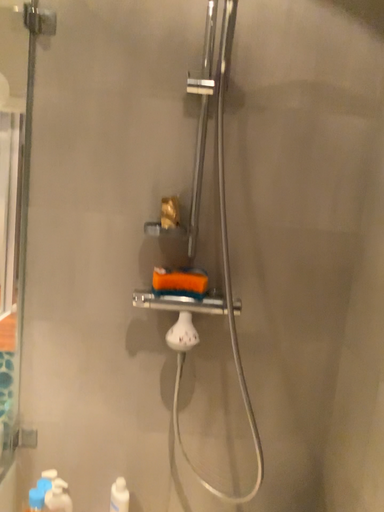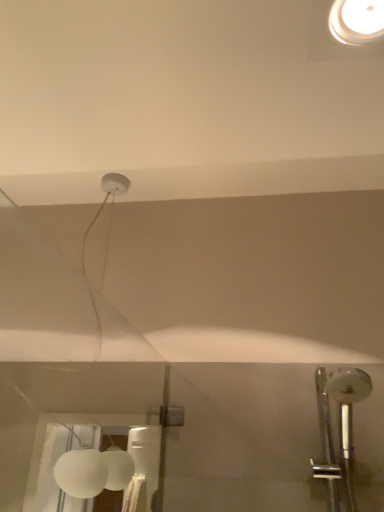
Question: How did the camera likely rotate when shooting the video?

Choices:
 (A) rotated upward
 (B) rotated downward

Answer: (A)